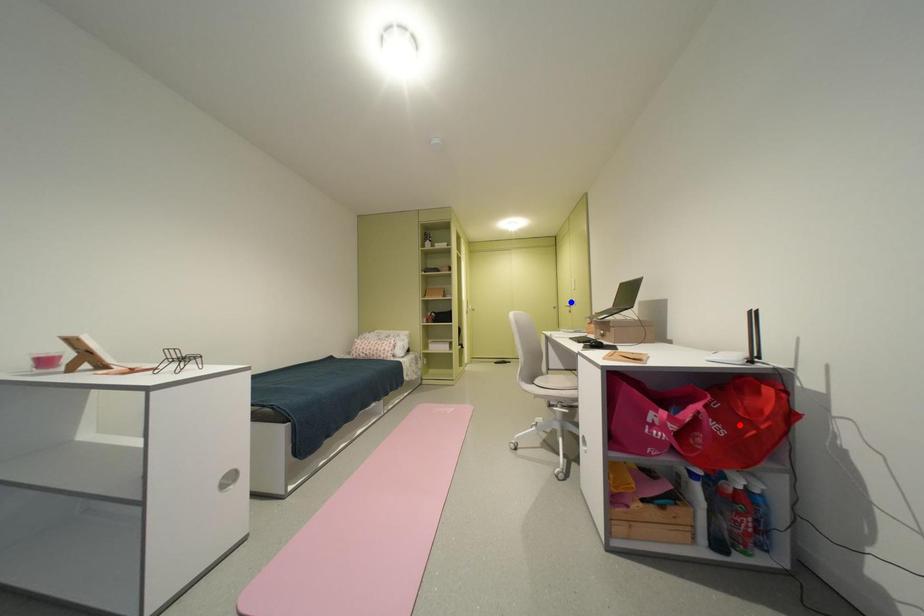
Question: Which of the two points in the image is closer to the camera?

Choices:
 (A) Blue point is closer.
 (B) Red point is closer.

Answer: (B)